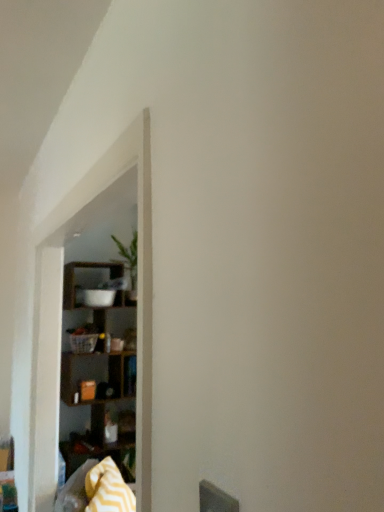
Find the location of a particular element. This screenshot has width=384, height=512. green leafy plant at upper center is located at coordinates (129, 257).

Image resolution: width=384 pixels, height=512 pixels. In order to click on wooden shelf at center in this screenshot , I will do `click(60, 313)`.

At what (x,y) coordinates should I click in order to perform the action: click on yellow zigzag blanket at lower left. Please return your answer as a coordinate pair (x, y). Looking at the image, I should click on (108, 489).

This screenshot has width=384, height=512. Find the location of `green leafy plant at upper center`. green leafy plant at upper center is located at coordinates (129, 257).

Is yellow zigzag blanket at lower left positioned in front of wooden shelf at center?

No, it is not.

How distant is yellow zigzag blanket at lower left from wooden shelf at center?

yellow zigzag blanket at lower left and wooden shelf at center are 61.05 centimeters apart.

From the image's perspective, is yellow zigzag blanket at lower left located beneath wooden shelf at center?

A: Indeed, from the image's perspective, yellow zigzag blanket at lower left is shown beneath wooden shelf at center.

From a real-world perspective, is yellow zigzag blanket at lower left physically below wooden shelf at center?

Yes, from a real-world perspective, yellow zigzag blanket at lower left is under wooden shelf at center.

Between yellow zigzag blanket at lower left and wooden shelf at left, which one has more height?

wooden shelf at left is taller.

Considering the points (97, 489) and (64, 426), which point is in front, point (97, 489) or point (64, 426)?

The point (97, 489) is in front.

Is yellow zigzag blanket at lower left positioned with its back to wooden shelf at left?

No, yellow zigzag blanket at lower left is not facing away from wooden shelf at left.

Locate an element on the screen. Image resolution: width=384 pixels, height=512 pixels. blanket on the right of wooden shelf at left is located at coordinates click(x=108, y=489).

Which of these two, green leafy plant at upper center or yellow zigzag blanket at lower left, is bigger?

yellow zigzag blanket at lower left.

Which object is wider, green leafy plant at upper center or yellow zigzag blanket at lower left?

green leafy plant at upper center is wider.

Considering the positions of points (130, 279) and (113, 487), is point (130, 279) closer to camera compared to point (113, 487)?

No.

Does green leafy plant at upper center contain yellow zigzag blanket at lower left?

Actually, yellow zigzag blanket at lower left is outside green leafy plant at upper center.

You are a GUI agent. You are given a task and a screenshot of the screen. Output one action in this format:
    pyautogui.click(x=<x>, y=<y>)
    Task: Click on the plant behind the wooden shelf at left
    
    Given the screenshot: What is the action you would take?
    (x=129, y=257)

Can you confirm if green leafy plant at upper center is shorter than wooden shelf at left?

Yes.

From a real-world perspective, is green leafy plant at upper center physically above wooden shelf at left?

Yes, from a real-world perspective, green leafy plant at upper center is on top of wooden shelf at left.

Based on their positions, is green leafy plant at upper center located to the left or right of wooden shelf at left?

Based on their positions, green leafy plant at upper center is located to the right of wooden shelf at left.

Does point (136, 262) come closer to viewer compared to point (150, 506)?

No.

Do you think green leafy plant at upper center is within wooden shelf at center, or outside of it?

green leafy plant at upper center cannot be found inside wooden shelf at center.

Between green leafy plant at upper center and wooden shelf at center, which one has larger width?

green leafy plant at upper center is wider.

From the image's perspective, would you say green leafy plant at upper center is shown under wooden shelf at center?

No, from the image's perspective, green leafy plant at upper center is not below wooden shelf at center.

Could you tell me if wooden shelf at left is turned towards green leafy plant at upper center?

No, wooden shelf at left is not turned towards green leafy plant at upper center.

The image size is (384, 512). What are the coordinates of `shelf on the left of the green leafy plant at upper center` in the screenshot? It's located at (99, 368).

Who is smaller, wooden shelf at left or green leafy plant at upper center?

green leafy plant at upper center.

From the image's perspective, between wooden shelf at left and green leafy plant at upper center, who is located below?

wooden shelf at left is shown below in the image.

Is the depth of wooden shelf at left less than that of wooden shelf at center?

No, the depth of wooden shelf at left is greater than that of wooden shelf at center.

From the image's perspective, is wooden shelf at left located above wooden shelf at center?

No, from the image's perspective, wooden shelf at left is not on top of wooden shelf at center.

Does point (108, 314) come farther from viewer compared to point (151, 221)?

Yes, it is behind point (151, 221).

In terms of height, does wooden shelf at left look taller or shorter compared to wooden shelf at center?

wooden shelf at left is taller than wooden shelf at center.

You are a GUI agent. You are given a task and a screenshot of the screen. Output one action in this format:
    pyautogui.click(x=<x>, y=<y>)
    Task: Click on the window sill on the left side of yellow zigzag blanket at lower left
    
    Given the screenshot: What is the action you would take?
    pyautogui.click(x=60, y=313)

The image size is (384, 512). What are the coordinates of `blanket to the right of wooden shelf at left` in the screenshot? It's located at (108, 489).

Estimate the real-world distances between objects in this image. Which object is closer to wooden shelf at center, yellow zigzag blanket at lower left or wooden shelf at left?

yellow zigzag blanket at lower left lies closer to wooden shelf at center than the other object.

Estimate the real-world distances between objects in this image. Which object is further from yellow zigzag blanket at lower left, green leafy plant at upper center or wooden shelf at left?

Based on the image, green leafy plant at upper center appears to be further to yellow zigzag blanket at lower left.

In the scene shown: Looking at the image, which one is located further to green leafy plant at upper center, wooden shelf at left or yellow zigzag blanket at lower left?

The object further to green leafy plant at upper center is yellow zigzag blanket at lower left.

Which object lies nearer to the anchor point yellow zigzag blanket at lower left, wooden shelf at center or wooden shelf at left?

wooden shelf at center is positioned closer to the anchor yellow zigzag blanket at lower left.

Estimate the real-world distances between objects in this image. Which object is closer to wooden shelf at left, green leafy plant at upper center or wooden shelf at center?

green leafy plant at upper center.

From the image, which object appears to be farther from wooden shelf at center, yellow zigzag blanket at lower left or green leafy plant at upper center?

green leafy plant at upper center.

From the image, which object appears to be farther from wooden shelf at center, green leafy plant at upper center or wooden shelf at left?

Based on the image, green leafy plant at upper center appears to be further to wooden shelf at center.

From the image, which object appears to be nearer to wooden shelf at left, yellow zigzag blanket at lower left or wooden shelf at center?

wooden shelf at center lies closer to wooden shelf at left than the other object.

This screenshot has width=384, height=512. Find the location of `shelf between yellow zigzag blanket at lower left and green leafy plant at upper center in the front-back direction`. shelf between yellow zigzag blanket at lower left and green leafy plant at upper center in the front-back direction is located at coordinates (99, 368).

Image resolution: width=384 pixels, height=512 pixels. In order to click on shelf located between wooden shelf at center and green leafy plant at upper center in the depth direction in this screenshot , I will do `click(99, 368)`.

Where is `blanket positioned between wooden shelf at center and green leafy plant at upper center from near to far`? The width and height of the screenshot is (384, 512). blanket positioned between wooden shelf at center and green leafy plant at upper center from near to far is located at coordinates (108, 489).

This screenshot has height=512, width=384. What are the coordinates of `blanket between wooden shelf at center and wooden shelf at left in the front-back direction` in the screenshot? It's located at tap(108, 489).